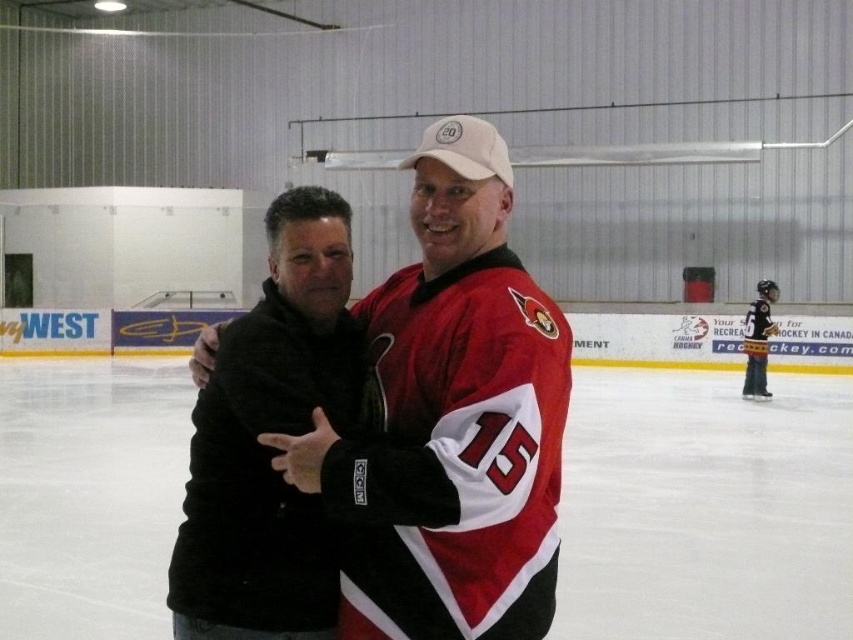
Question: Is matte black jacket at center to the left of black jersey at right from the viewer's perspective?

Choices:
 (A) yes
 (B) no

Answer: (A)

Question: Which object appears farthest from the camera in this image?

Choices:
 (A) black jersey at right
 (B) matte black jacket at center
 (C) black fuzzy jacket at center

Answer: (A)

Question: Which object is closer to the camera taking this photo?

Choices:
 (A) matte black jacket at center
 (B) black fuzzy jacket at center

Answer: (A)

Question: Can you confirm if black fuzzy jacket at center is positioned to the left of black jersey at right?

Choices:
 (A) yes
 (B) no

Answer: (A)

Question: Is black fuzzy jacket at center positioned behind black jersey at right?

Choices:
 (A) no
 (B) yes

Answer: (A)

Question: Which point is farther from the camera taking this photo?

Choices:
 (A) (196, 577)
 (B) (401, 404)

Answer: (A)